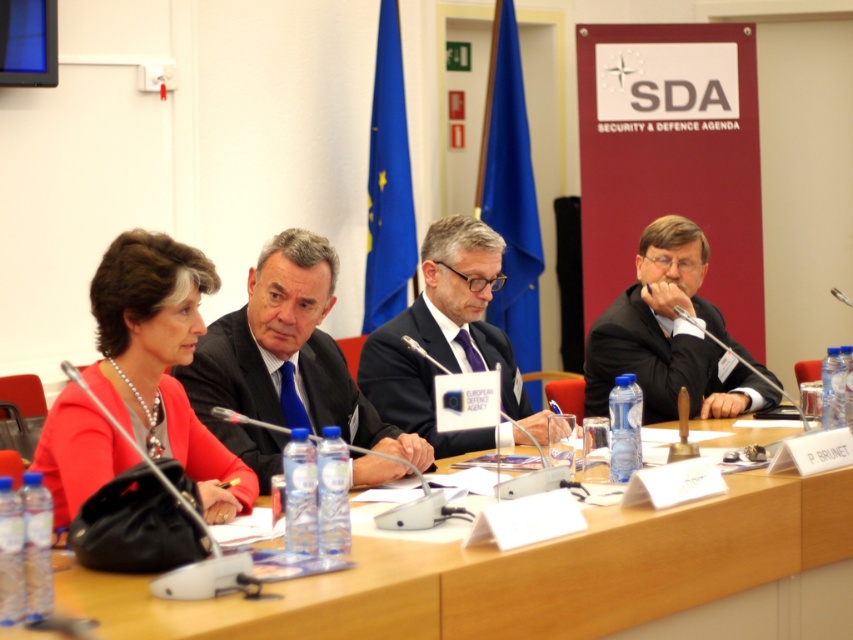
Question: Which object is the closest to the wooden table at center?

Choices:
 (A) black suit at right
 (B) dark gray suit at center

Answer: (B)

Question: Is dark blue suit at center thinner than dark gray suit at center?

Choices:
 (A) no
 (B) yes

Answer: (A)

Question: Which of the following is the farthest from the observer?

Choices:
 (A) black suit at right
 (B) dark blue suit at center
 (C) wooden table at center
 (D) matte red blouse at center

Answer: (A)

Question: Based on their relative distances, which object is nearer to the matte red blouse at center?

Choices:
 (A) wooden table at center
 (B) black suit at right
 (C) dark gray suit at center
 (D) dark blue suit at center

Answer: (D)

Question: Is wooden table at center closer to camera compared to black suit at right?

Choices:
 (A) yes
 (B) no

Answer: (A)

Question: Does dark blue suit at center have a larger size compared to black suit at right?

Choices:
 (A) no
 (B) yes

Answer: (A)